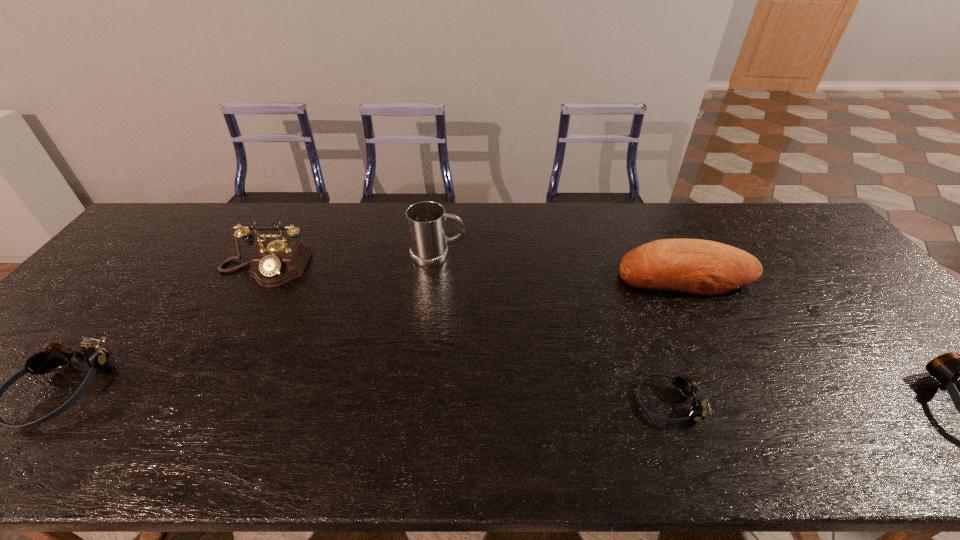
You are a GUI agent. You are given a task and a screenshot of the screen. Output one action in this format:
    pyautogui.click(x=<x>, y=<y>)
    Task: Click on the vacant area that lies between the mug and the telephone
    The height and width of the screenshot is (540, 960).
    Given the screenshot: What is the action you would take?
    pyautogui.click(x=351, y=262)

At what (x,y) coordinates should I click in order to perform the action: click on vacant area that lies between the second goggles from left to right and the telephone. Please return your answer as a coordinate pair (x, y). Looking at the image, I should click on (467, 335).

The image size is (960, 540). I want to click on free space between the telephone and the fourth object from right to left, so click(x=351, y=262).

Find the location of a particular element. free spot between the fourth object from right to left and the fifth object from right to left is located at coordinates (351, 262).

Identify the location of the closest object to the rightmost object. The height and width of the screenshot is (540, 960). (703, 267).

Image resolution: width=960 pixels, height=540 pixels. Identify the location of object that is the fourth closest to the rightmost object. (277, 262).

Locate an element on the screen. This screenshot has height=540, width=960. goggles that is the closest to the shortest goggles is located at coordinates (947, 368).

This screenshot has height=540, width=960. I want to click on goggles that is the second closest to the leftmost goggles, so click(x=947, y=368).

Locate an element on the screen. This screenshot has width=960, height=540. vacant space that satisfies the following two spatial constraints: 1. on the dial of the bread; 2. on the left side of the fifth object from right to left is located at coordinates (261, 275).

I want to click on free spot that satisfies the following two spatial constraints: 1. on the back side of the fourth shortest object; 2. on the side of the mug with the handle, so click(x=676, y=256).